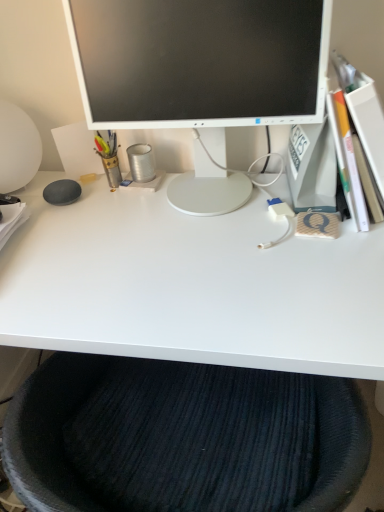
Locate an element on the screen. The image size is (384, 512). free space to the left of white glossy monitor at center is located at coordinates (82, 225).